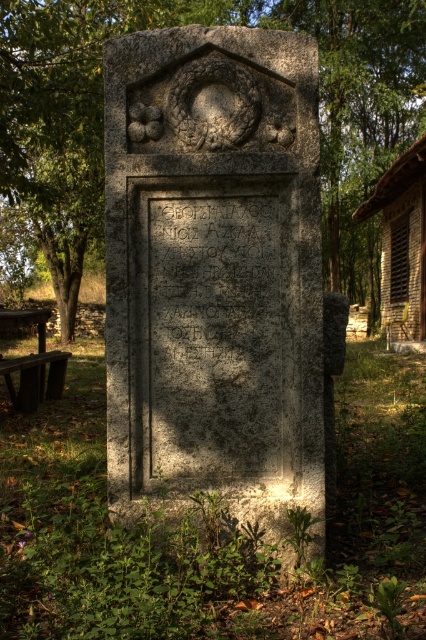
Does gray stone monument at center have a smaller size compared to wooden planks hut at right?

No.

The height and width of the screenshot is (640, 426). In order to click on gray stone monument at center in this screenshot , I will do `click(215, 272)`.

At what (x,y) coordinates should I click in order to perform the action: click on gray stone monument at center. Please return your answer as a coordinate pair (x, y). Looking at the image, I should click on [215, 272].

Does green leafy tree at upper left lie in front of wooden planks hut at right?

That is True.

Who is more forward, (x=80, y=84) or (x=397, y=253)?

Point (x=80, y=84) is in front.

Where is `green leafy tree at upper left`? Image resolution: width=426 pixels, height=640 pixels. green leafy tree at upper left is located at coordinates (204, 22).

Does gray stone monument at center have a lesser height compared to green leafy tree at upper left?

Correct, gray stone monument at center is not as tall as green leafy tree at upper left.

Between gray stone monument at center and green leafy tree at upper left, which one appears on the left side from the viewer's perspective?

green leafy tree at upper left

Is point (126, 442) positioned before point (5, 166)?

Yes.

Identify the location of gray stone monument at center. (215, 272).